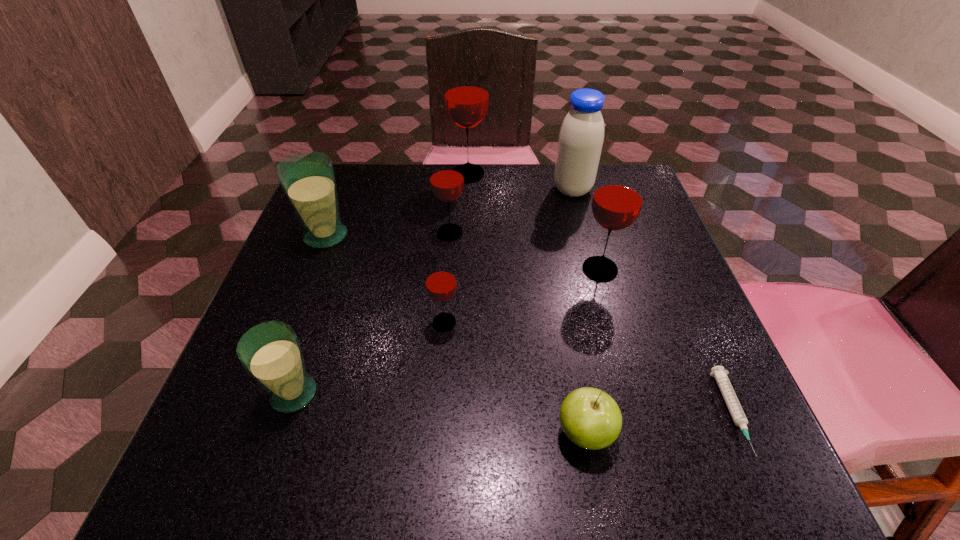
The height and width of the screenshot is (540, 960). I want to click on vacant space located on the right of the nearest glass, so click(x=407, y=394).

In order to click on vacant space located 0.090m on the right of the sixth farthest object in this screenshot , I will do `click(509, 322)`.

The height and width of the screenshot is (540, 960). In order to click on vacant space situated on the left of the apple in this screenshot , I will do `click(447, 433)`.

You are a GUI agent. You are given a task and a screenshot of the screen. Output one action in this format:
    pyautogui.click(x=<x>, y=<y>)
    Task: Click on the glass located at the far edge
    
    Given the screenshot: What is the action you would take?
    pyautogui.click(x=466, y=90)

Identify the location of soya milk present at the far edge. This screenshot has width=960, height=540. (581, 136).

Image resolution: width=960 pixels, height=540 pixels. What are the coordinates of `apple present at the near edge` in the screenshot? It's located at (590, 418).

Locate an element on the screen. This screenshot has height=540, width=960. syringe that is at the near edge is located at coordinates (732, 402).

Where is `soya milk at the right edge`? The width and height of the screenshot is (960, 540). soya milk at the right edge is located at coordinates (581, 136).

The height and width of the screenshot is (540, 960). What are the coordinates of `glass that is at the right edge` in the screenshot? It's located at [x=618, y=198].

Identify the location of syringe located at the right edge. The height and width of the screenshot is (540, 960). (732, 402).